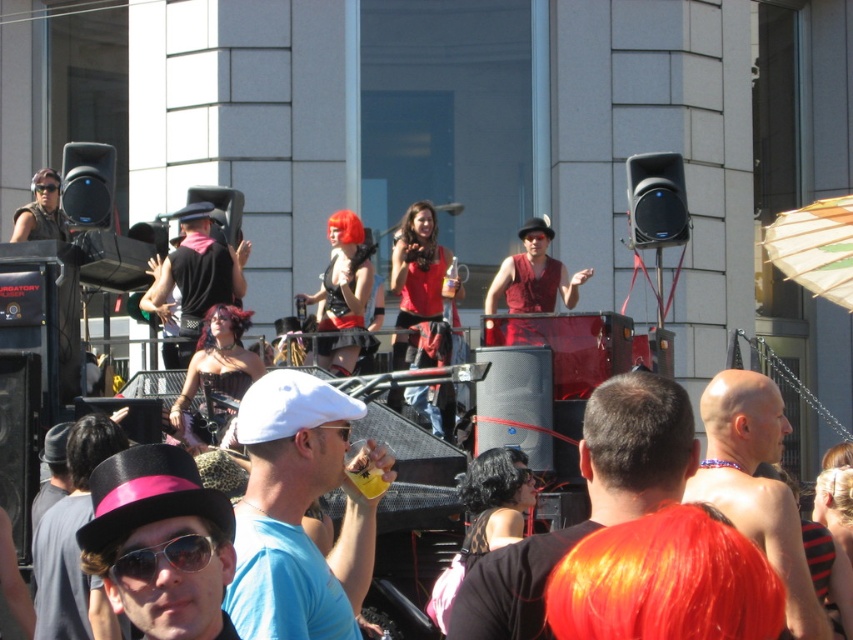
Who is shorter, bald head at center or sunglasses at center?

sunglasses at center

Based on the photo, is bald head at center shorter than sunglasses at center?

No.

Is point (744, 429) positioned behind point (218, 541)?

Yes, point (744, 429) is farther from viewer.

Where is `bald head at center`? This screenshot has width=853, height=640. bald head at center is located at coordinates (756, 484).

Between point (251, 547) and point (44, 189), which one is positioned in front?

Positioned in front is point (251, 547).

Is white matte cap at center above brushed metal goggles at upper center?

No, white matte cap at center is not above brushed metal goggles at upper center.

Which is behind, point (239, 524) or point (42, 186)?

The point (42, 186) is more distant.

Where is `white matte cap at center`? This screenshot has width=853, height=640. white matte cap at center is located at coordinates (300, 512).

Which is more to the left, sunglasses at center or brushed metal goggles at upper center?

brushed metal goggles at upper center is more to the left.

Can you confirm if sunglasses at center is wider than brushed metal goggles at upper center?

Yes, sunglasses at center is wider than brushed metal goggles at upper center.

Is point (196, 536) less distant than point (50, 189)?

Yes, it is in front of point (50, 189).

At what (x,y) coordinates should I click in order to perform the action: click on sunglasses at center. Please return your answer as a coordinate pair (x, y). This screenshot has height=640, width=853. Looking at the image, I should click on (165, 557).